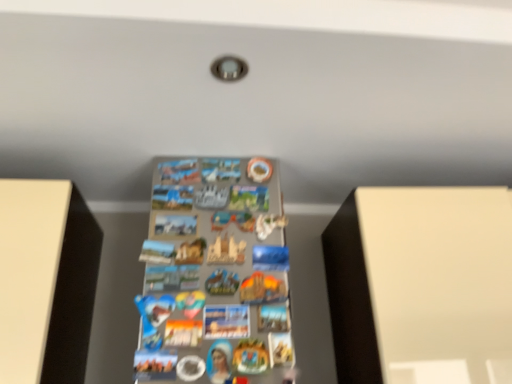
Question: Which is correct: metallic silver magnets at center is inside white matte cabinet at right, or outside of it?

Choices:
 (A) inside
 (B) outside

Answer: (B)

Question: Considering the positions of metallic silver magnets at center and white matte cabinet at right in the image, is metallic silver magnets at center taller or shorter than white matte cabinet at right?

Choices:
 (A) tall
 (B) short

Answer: (A)

Question: In the image, is metallic silver magnets at center on the left side or the right side of white matte cabinet at right?

Choices:
 (A) right
 (B) left

Answer: (B)

Question: From their relative heights in the image, would you say white matte cabinet at right is taller or shorter than metallic silver magnets at center?

Choices:
 (A) short
 (B) tall

Answer: (A)

Question: Is white matte cabinet at right inside or outside of metallic silver magnets at center?

Choices:
 (A) outside
 (B) inside

Answer: (A)

Question: In terms of width, does white matte cabinet at right look wider or thinner when compared to metallic silver magnets at center?

Choices:
 (A) thin
 (B) wide

Answer: (A)

Question: Considering their positions, is white matte cabinet at right located in front of or behind metallic silver magnets at center?

Choices:
 (A) behind
 (B) front

Answer: (A)